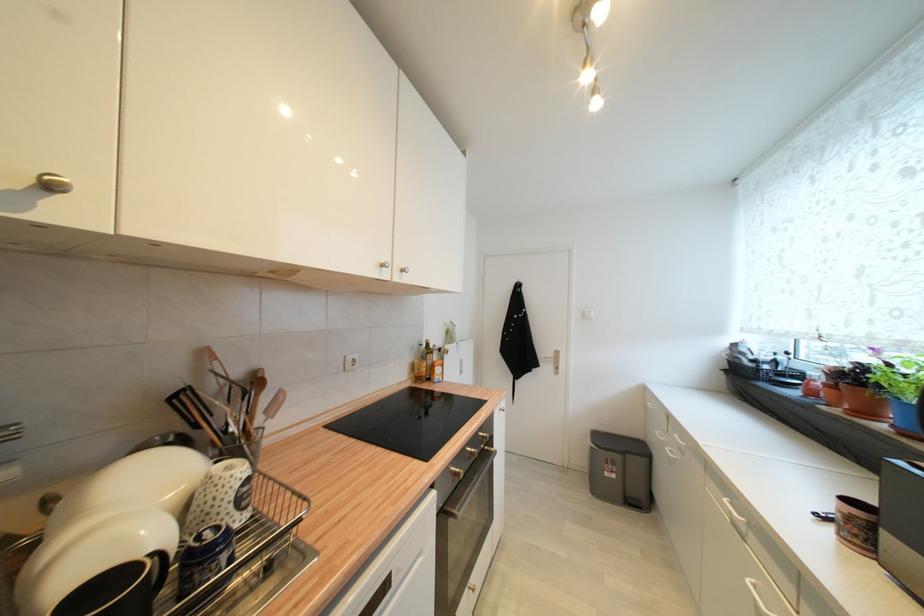
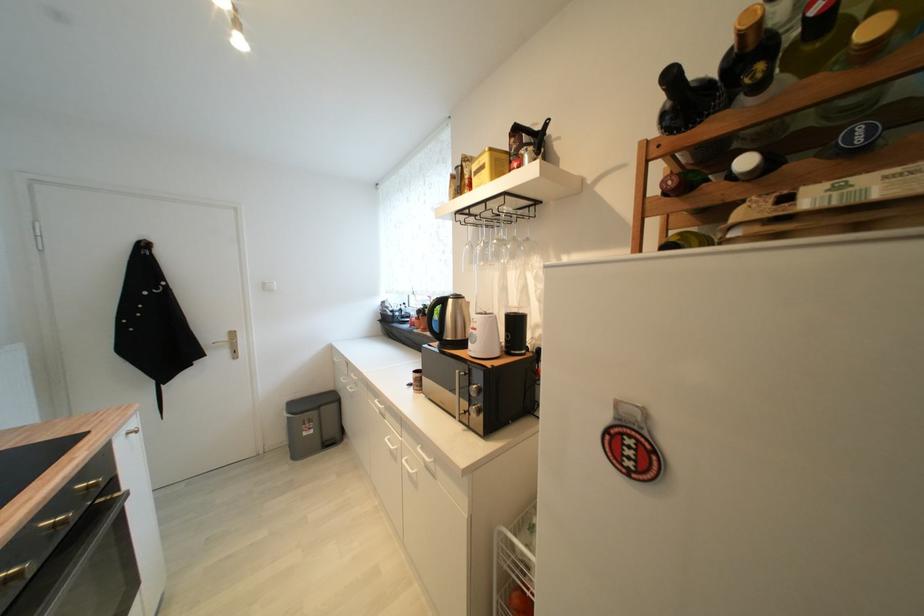
Locate, in the second image, the point that corresponds to point 612,476 in the first image.

(310, 436)